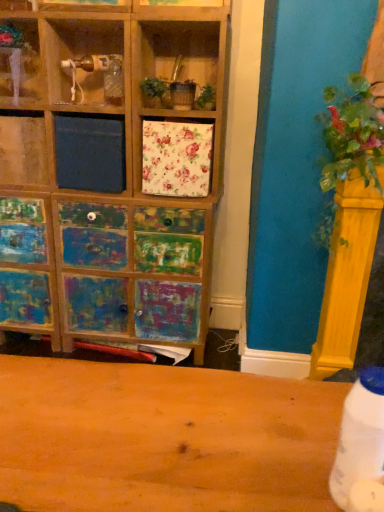
Question: Should I look upward or downward to see white plastic bottle at lower right?

Choices:
 (A) down
 (B) up

Answer: (A)

Question: Is wooden shelf at upper left next to white plastic bottle at lower right?

Choices:
 (A) yes
 (B) no

Answer: (B)

Question: Is wooden shelf at upper left smaller than white plastic bottle at lower right?

Choices:
 (A) yes
 (B) no

Answer: (B)

Question: Does wooden shelf at upper left appear on the right side of white plastic bottle at lower right?

Choices:
 (A) no
 (B) yes

Answer: (A)

Question: From a real-world perspective, is wooden shelf at upper left over white plastic bottle at lower right?

Choices:
 (A) no
 (B) yes

Answer: (B)

Question: Does wooden shelf at upper left have a lesser height compared to white plastic bottle at lower right?

Choices:
 (A) no
 (B) yes

Answer: (A)

Question: From a real-world perspective, does wooden shelf at upper left sit lower than white plastic bottle at lower right?

Choices:
 (A) no
 (B) yes

Answer: (A)

Question: Could you tell me if green leafy plant at right is facing wooden shelf at upper left?

Choices:
 (A) no
 (B) yes

Answer: (A)

Question: Is green leafy plant at right further to camera compared to wooden shelf at upper left?

Choices:
 (A) yes
 (B) no

Answer: (B)

Question: From a real-world perspective, is green leafy plant at right physically above wooden shelf at upper left?

Choices:
 (A) no
 (B) yes

Answer: (A)

Question: Is green leafy plant at right next to wooden shelf at upper left and touching it?

Choices:
 (A) yes
 (B) no

Answer: (B)

Question: Is green leafy plant at right wider than wooden shelf at upper left?

Choices:
 (A) no
 (B) yes

Answer: (B)

Question: Is green leafy plant at right bigger than wooden shelf at upper left?

Choices:
 (A) yes
 (B) no

Answer: (A)

Question: From the image's perspective, is wooden shelf at upper left above green leafy plant at right?

Choices:
 (A) yes
 (B) no

Answer: (A)